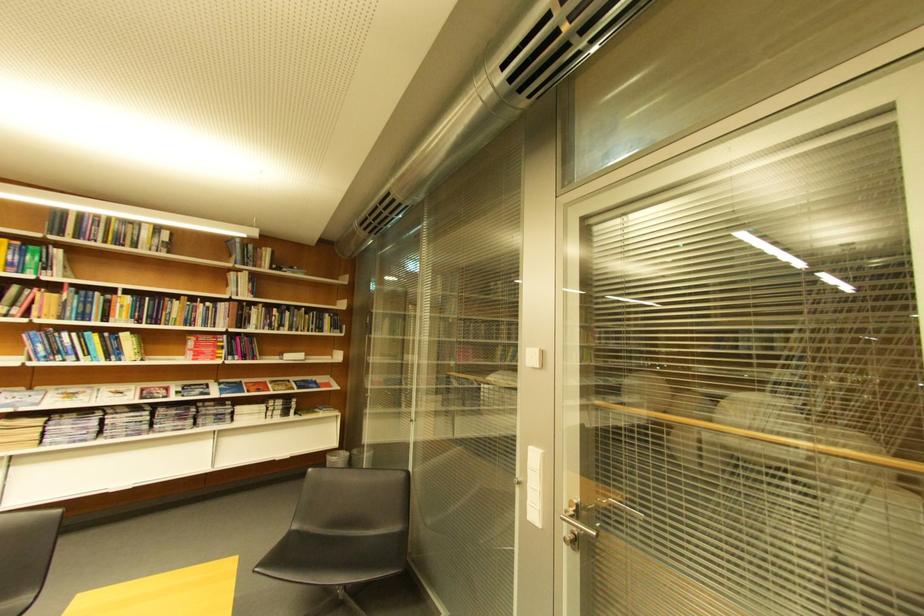
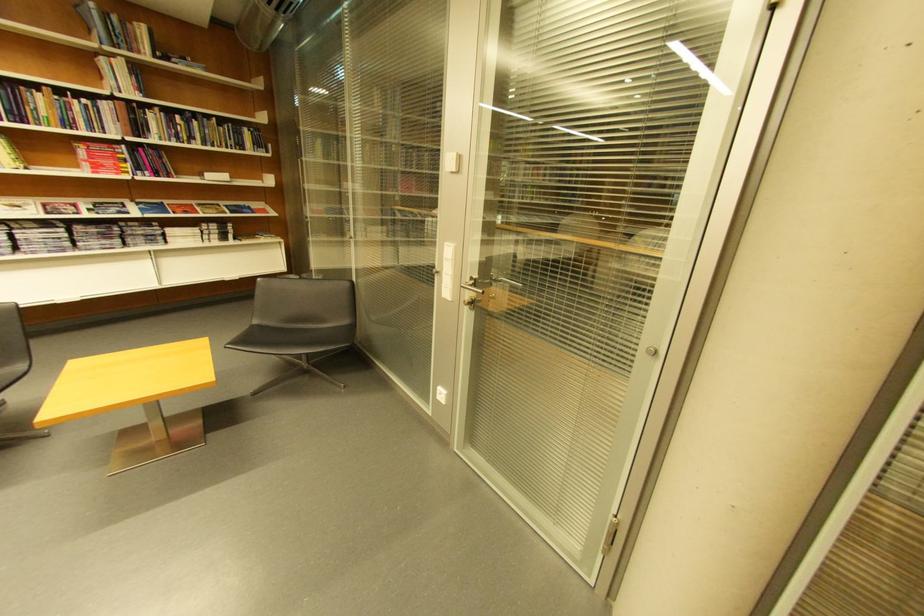
Find the pixel in the second image that matches point 298,315 in the first image.

(205, 124)